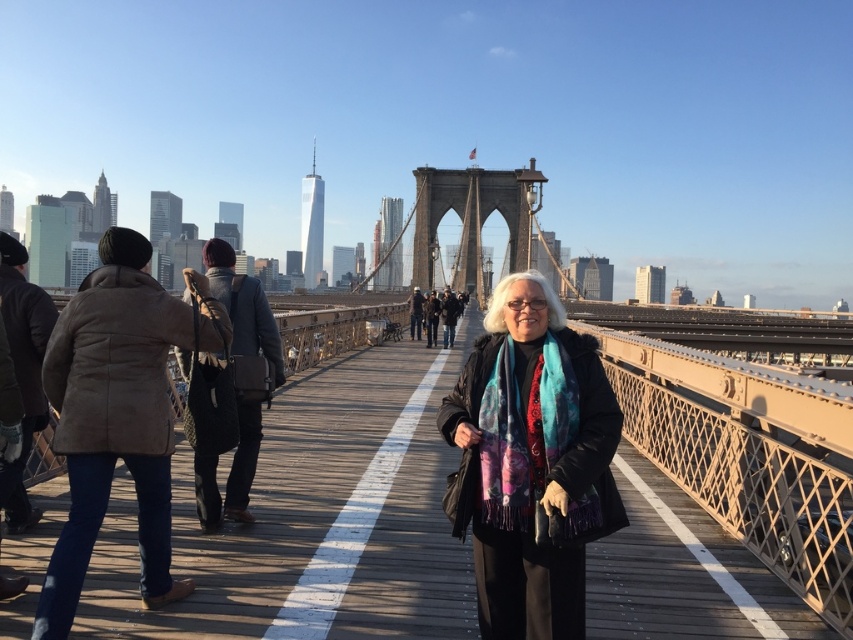
Which of these two, multicolored scarf at center or brown fuzzy coat at left, stands taller?

Standing taller between the two is brown fuzzy coat at left.

Can you confirm if multicolored scarf at center is thinner than brown fuzzy coat at left?

Correct, multicolored scarf at center's width is less than brown fuzzy coat at left's.

At what (x,y) coordinates should I click in order to perform the action: click on multicolored scarf at center. Please return your answer as a coordinate pair (x, y). Image resolution: width=853 pixels, height=640 pixels. Looking at the image, I should click on (532, 460).